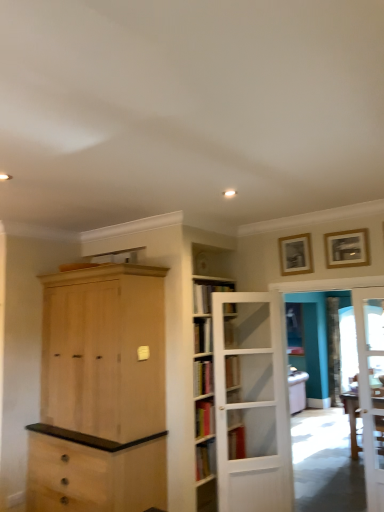
The image size is (384, 512). What do you see at coordinates (294, 329) in the screenshot?
I see `clear glass door at center` at bounding box center [294, 329].

The height and width of the screenshot is (512, 384). I want to click on white glass door at right, which is the 2th door from left to right, so click(x=371, y=387).

What do you see at coordinates (371, 387) in the screenshot? I see `white glass door at right, which is the 2th door from left to right` at bounding box center [371, 387].

The width and height of the screenshot is (384, 512). What do you see at coordinates (347, 248) in the screenshot? I see `wooden picture frame at upper right, the second picture frame positioned from the left` at bounding box center [347, 248].

This screenshot has width=384, height=512. What are the coordinates of `gold wooden picture frame at upper right, arranged as the second picture frame when viewed from the front` in the screenshot? It's located at (295, 254).

This screenshot has width=384, height=512. I want to click on hardcover book at center, so click(206, 296).

Identify the location of white wooden door at center, the first door when ordered from left to right. The width and height of the screenshot is (384, 512). (251, 403).

Is wooden picture frame at upper right, which is the 1th picture frame in front-to-back order, in front of or behind white glass door at right, which is the 2th door from left to right, in the image?

Visually, wooden picture frame at upper right, which is the 1th picture frame in front-to-back order, is located behind white glass door at right, which is the 2th door from left to right.

Is wooden picture frame at upper right, which is counted as the 1th picture frame, starting from the right, in contact with white glass door at right, positioned as the first door in right-to-left order?

No, wooden picture frame at upper right, which is counted as the 1th picture frame, starting from the right, is not making contact with white glass door at right, positioned as the first door in right-to-left order.

Measure the distance between wooden picture frame at upper right, which is counted as the 1th picture frame, starting from the right, and white glass door at right, positioned as the first door in right-to-left order.

wooden picture frame at upper right, which is counted as the 1th picture frame, starting from the right, and white glass door at right, positioned as the first door in right-to-left order, are 24.76 inches apart.

I want to click on the 1st picture frame directly above the white glass door at right, positioned as the first door in right-to-left order (from a real-world perspective), so click(347, 248).

Is wooden table at right a part of wooden picture frame at upper right, which is counted as the 1th picture frame, starting from the right?

No, wooden table at right is not inside wooden picture frame at upper right, which is counted as the 1th picture frame, starting from the right.

Does wooden picture frame at upper right, which is the 1th picture frame in front-to-back order, turn towards wooden table at right?

No, wooden picture frame at upper right, which is the 1th picture frame in front-to-back order, is not turned towards wooden table at right.

Which is in front, point (334, 234) or point (352, 404)?

Positioned in front is point (334, 234).

From the image's perspective, is wooden picture frame at upper right, which is counted as the 1th picture frame, starting from the right, located above or below wooden table at right?

wooden picture frame at upper right, which is counted as the 1th picture frame, starting from the right, is above wooden table at right.

How many degrees apart are the facing directions of clear glass door at center and natural wood cabinet at center?

The angle between the facing direction of clear glass door at center and the facing direction of natural wood cabinet at center is 0.136 degrees.

From their relative heights in the image, would you say clear glass door at center is taller or shorter than natural wood cabinet at center?

In the image, clear glass door at center appears to be shorter than natural wood cabinet at center.

From the image's perspective, which object appears higher, clear glass door at center or natural wood cabinet at center?

natural wood cabinet at center, from the image's perspective.

Is clear glass door at center inside the boundaries of natural wood cabinet at center, or outside?

clear glass door at center is located beyond the bounds of natural wood cabinet at center.

Is the surface of gold wooden picture frame at upper right, arranged as the second picture frame when viewed from the front, in direct contact with white wooden door at center, the first door when ordered from left to right?

No, gold wooden picture frame at upper right, arranged as the second picture frame when viewed from the front, is not beside white wooden door at center, the first door when ordered from left to right.

Measure the distance between gold wooden picture frame at upper right, the 1th picture frame positioned from the left, and white wooden door at center, which ranks as the second door in right-to-left order.

gold wooden picture frame at upper right, the 1th picture frame positioned from the left, and white wooden door at center, which ranks as the second door in right-to-left order, are 1.01 meters apart from each other.

Can white wooden door at center, the first door when ordered from left to right, be found inside gold wooden picture frame at upper right, the second picture frame viewed from the right?

That's incorrect, white wooden door at center, the first door when ordered from left to right, is not inside gold wooden picture frame at upper right, the second picture frame viewed from the right.

Which is correct: white glass door at right, positioned as the first door in right-to-left order, is inside gold wooden picture frame at upper right, the 1th picture frame positioned from the left, or outside of it?

white glass door at right, positioned as the first door in right-to-left order, exists outside the volume of gold wooden picture frame at upper right, the 1th picture frame positioned from the left.

Between white glass door at right, positioned as the first door in right-to-left order, and gold wooden picture frame at upper right, which is counted as the 1th picture frame, starting from the back, which one has more height?

white glass door at right, positioned as the first door in right-to-left order.

From a real-world perspective, is white glass door at right, which is the 2th door from left to right, above or below gold wooden picture frame at upper right, arranged as the second picture frame when viewed from the front?

From a real-world perspective, white glass door at right, which is the 2th door from left to right, is physically below gold wooden picture frame at upper right, arranged as the second picture frame when viewed from the front.

Considering the relative sizes of white glass door at right, which is the 2th door from left to right, and gold wooden picture frame at upper right, the second picture frame viewed from the right, in the image provided, is white glass door at right, which is the 2th door from left to right, bigger than gold wooden picture frame at upper right, the second picture frame viewed from the right,?

Indeed, white glass door at right, which is the 2th door from left to right, has a larger size compared to gold wooden picture frame at upper right, the second picture frame viewed from the right.

Considering the relative sizes of wooden table at right and hardcover book at center in the image provided, is wooden table at right bigger than hardcover book at center?

Indeed, wooden table at right has a larger size compared to hardcover book at center.

Locate an element on the screen. The height and width of the screenshot is (512, 384). book located above the wooden table at right (from the image's perspective) is located at coordinates (206, 296).

Considering the relative positions of wooden table at right and hardcover book at center in the image provided, is wooden table at right to the left of hardcover book at center from the viewer's perspective?

No, wooden table at right is not to the left of hardcover book at center.

Find the location of a particular element. cabinetry that is on the left side of white wooden door at center, which ranks as the second door in right-to-left order is located at coordinates (104, 351).

Does point (135, 322) lie in front of point (273, 488)?

Yes, it is in front of point (273, 488).

Is natural wood cabinet at center not near white wooden door at center, which ranks as the second door in right-to-left order?

No.

Image resolution: width=384 pixels, height=512 pixels. I want to click on door lying on the right of wooden picture frame at upper right, which is the 2th picture frame from back to front, so click(x=371, y=387).

Starting from the wooden table at right, which picture frame is the 1st one to the left? Please provide its 2D coordinates.

[(347, 248)]

Looking at the image, which one is located closer to gold wooden picture frame at upper right, the second picture frame viewed from the right, wooden table at right or white glass door at right, which is the 2th door from left to right?

Based on the image, white glass door at right, which is the 2th door from left to right, appears to be nearer to gold wooden picture frame at upper right, the second picture frame viewed from the right.

Looking at the image, which one is located further to natural wood cabinet at center, wooden picture frame at upper right, which is counted as the 1th picture frame, starting from the right, or gold wooden picture frame at upper right, arranged as the second picture frame when viewed from the front?

wooden picture frame at upper right, which is counted as the 1th picture frame, starting from the right.

From the picture: Looking at the image, which one is located further to white glass door at right, positioned as the first door in right-to-left order, clear glass door at center or wooden picture frame at upper right, which is counted as the 1th picture frame, starting from the right?

Among the two, clear glass door at center is located further to white glass door at right, positioned as the first door in right-to-left order.

Based on their spatial positions, is gold wooden picture frame at upper right, the 1th picture frame positioned from the left, or wooden table at right further from clear glass door at center?

Among the two, gold wooden picture frame at upper right, the 1th picture frame positioned from the left, is located further to clear glass door at center.

Considering their positions, is wooden picture frame at upper right, which is counted as the 1th picture frame, starting from the right, positioned closer to gold wooden picture frame at upper right, the 1th picture frame positioned from the left, than white glass door at right, positioned as the first door in right-to-left order?

Among the two, wooden picture frame at upper right, which is counted as the 1th picture frame, starting from the right, is located nearer to gold wooden picture frame at upper right, the 1th picture frame positioned from the left.

From the image, which object appears to be farther from natural wood cabinet at center, hardcover book at center or wooden picture frame at upper right, which is counted as the 1th picture frame, starting from the right?

wooden picture frame at upper right, which is counted as the 1th picture frame, starting from the right, lies further to natural wood cabinet at center than the other object.

When comparing their distances from white glass door at right, which is the 2th door from left to right, does gold wooden picture frame at upper right, which is counted as the 1th picture frame, starting from the back, or natural wood cabinet at center seem further?

Among the two, natural wood cabinet at center is located further to white glass door at right, which is the 2th door from left to right.

When comparing their distances from white glass door at right, which is the 2th door from left to right, does wooden table at right or natural wood cabinet at center seem closer?

wooden table at right.

Locate an element on the screen. book between gold wooden picture frame at upper right, the second picture frame viewed from the right, and white wooden door at center, which ranks as the second door in right-to-left order, in the up-down direction is located at coordinates (206, 296).

Find the location of a particular element. book located between natural wood cabinet at center and clear glass door at center in the depth direction is located at coordinates (206, 296).

Where is `book located between natural wood cabinet at center and white wooden door at center, which ranks as the second door in right-to-left order, in the left-right direction`? The height and width of the screenshot is (512, 384). book located between natural wood cabinet at center and white wooden door at center, which ranks as the second door in right-to-left order, in the left-right direction is located at coordinates (206, 296).

Where is `door between gold wooden picture frame at upper right, arranged as the second picture frame when viewed from the front, and white wooden door at center, the first door when ordered from left to right, in the up-down direction`? door between gold wooden picture frame at upper right, arranged as the second picture frame when viewed from the front, and white wooden door at center, the first door when ordered from left to right, in the up-down direction is located at coordinates (371, 387).